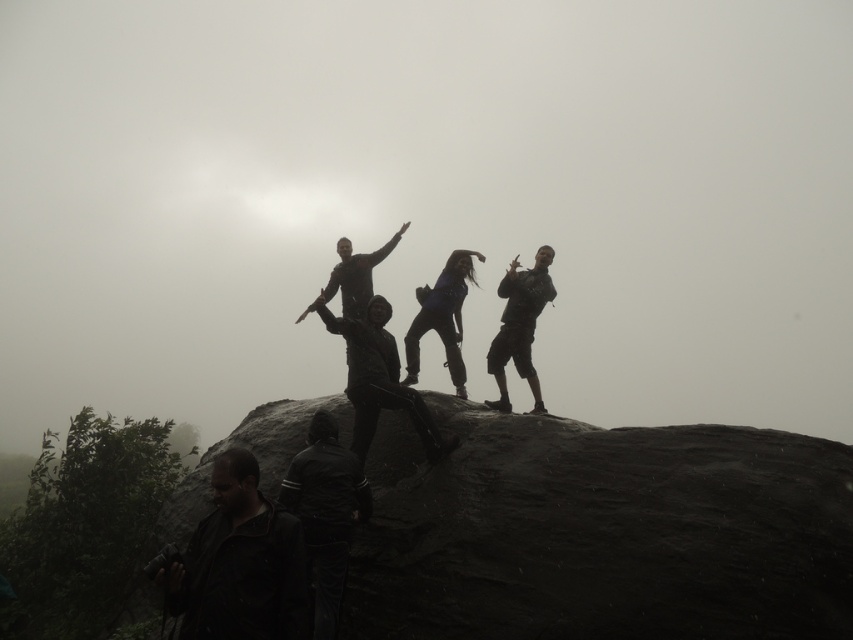
You are a photographer trying to capture the scene. You notice a point at coordinates (379, 378). What object is located at that point?

The point at coordinates (379, 378) is on the dark matte jacket at center.

You are a photographer trying to capture a clear photo of both the dark gray jacket at lower left and the dark gray leather jacket at lower left. Since they are close together, you want to ensure both are in focus. Which jacket should you focus on first to ensure the other is also in focus?

The dark gray jacket at lower left is positioned on the left side of dark gray leather jacket at lower left. To ensure both are in focus, you should focus on the dark gray jacket at lower left first, as it is closer to the camera, and the dark gray leather jacket at lower left will naturally fall into the depth of field.